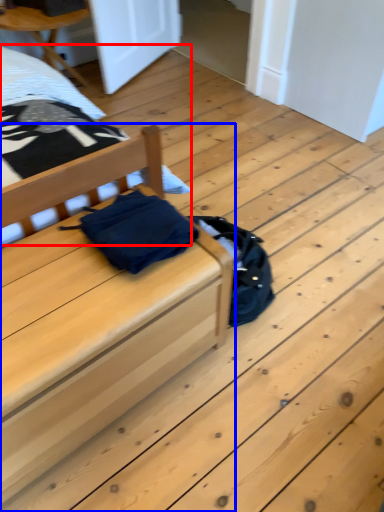
Question: Which point is further to the camera, bed (highlighted by a red box) or furniture (highlighted by a blue box)?

Choices:
 (A) bed
 (B) furniture

Answer: (A)